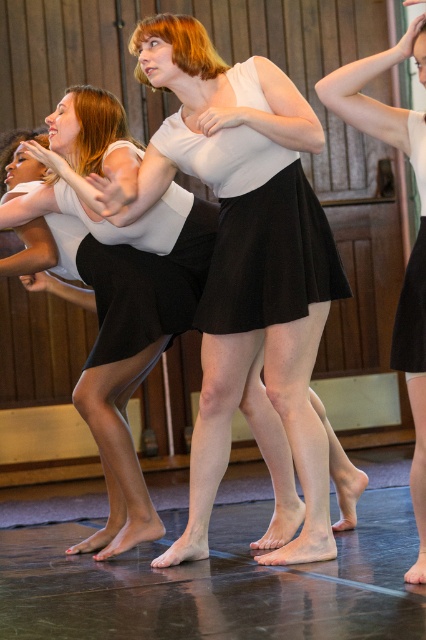
In the scene shown: Which is above, matte white blouse at center or black satin skirt at center?

Positioned higher is matte white blouse at center.

Between matte white blouse at center and black satin skirt at center, which one appears on the right side from the viewer's perspective?

Positioned to the right is black satin skirt at center.

Find the location of a particular element. matte white blouse at center is located at coordinates (379, 100).

Is white matte skirt at center bigger than black satin skirt at center?

Indeed, white matte skirt at center has a larger size compared to black satin skirt at center.

Can you confirm if white matte skirt at center is wider than black satin skirt at center?

Yes, white matte skirt at center is wider than black satin skirt at center.

Identify the location of white matte skirt at center. The width and height of the screenshot is (426, 640). (x=245, y=259).

Does black pleated skirt at center appear on the right side of black satin skirt at center?

No, black pleated skirt at center is not to the right of black satin skirt at center.

Is point (230, 305) positioned in front of point (409, 307)?

No, (230, 305) is behind (409, 307).

You are a GUI agent. You are given a task and a screenshot of the screen. Output one action in this format:
    pyautogui.click(x=<x>, y=<y>)
    Task: Click on the black pleated skirt at center
    The height and width of the screenshot is (640, 426).
    Given the screenshot: What is the action you would take?
    pyautogui.click(x=256, y=228)